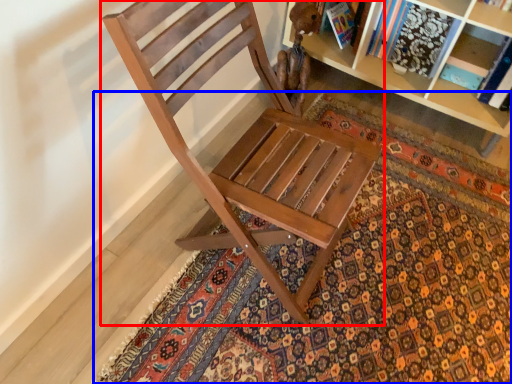
Question: Which object is further to the camera taking this photo, chair (highlighted by a red box) or doormat (highlighted by a blue box)?

Choices:
 (A) chair
 (B) doormat

Answer: (B)